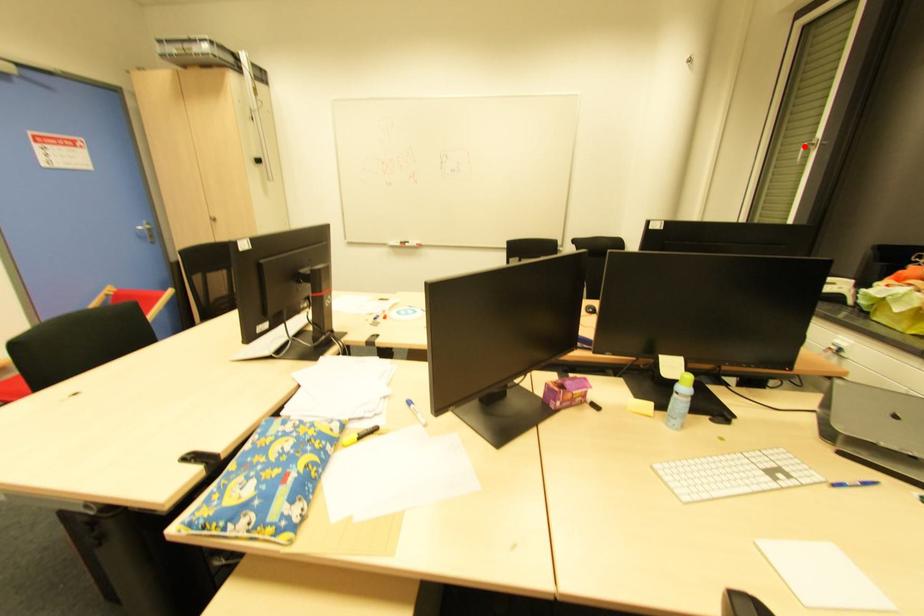
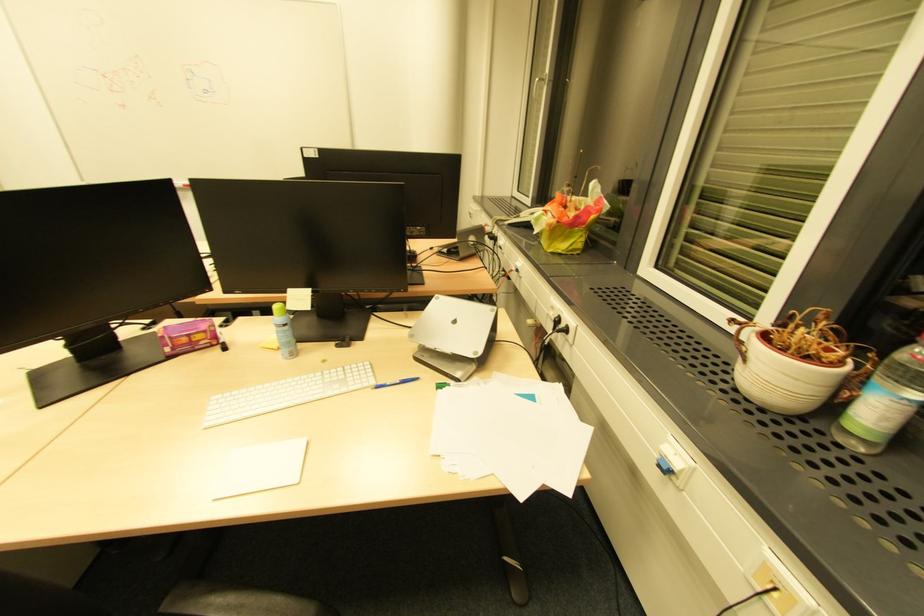
Where in the second image is the point corresponding to the highlighted location from the first image?

(536, 81)